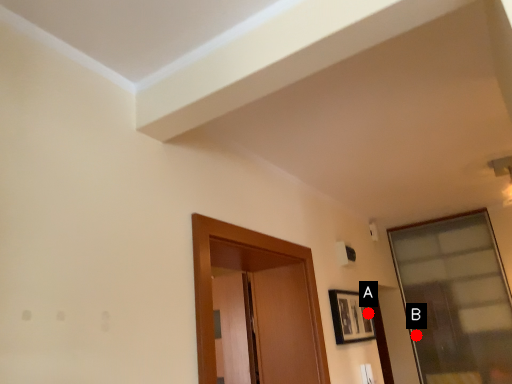
Question: Two points are circled on the image, labeled by A and B beside each circle. Which point is further to the camera?

Choices:
 (A) A is further
 (B) B is further

Answer: (B)